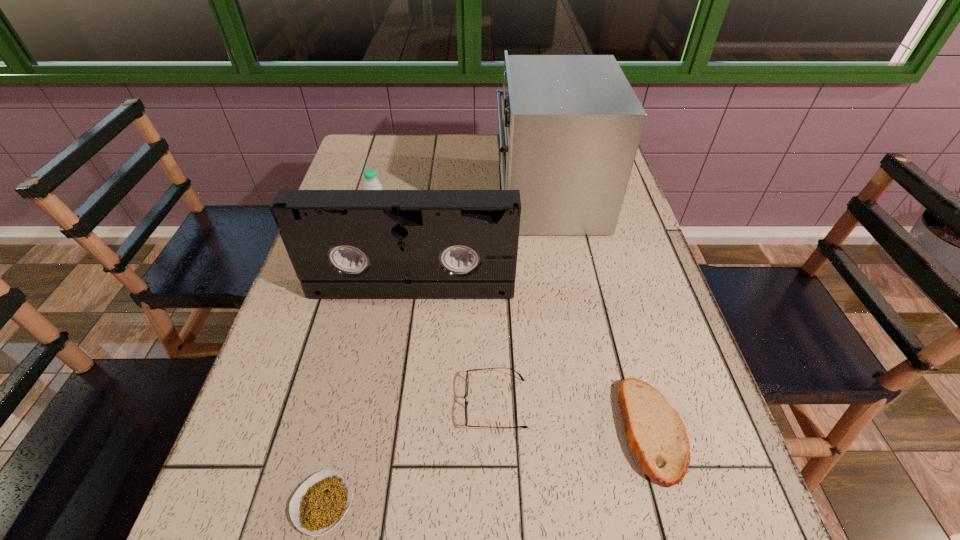
You are a GUI agent. You are given a task and a screenshot of the screen. Output one action in this format:
    pyautogui.click(x=<x>, y=<y>)
    Task: Click on the vacant point located between the pita bread and the videotape
    
    Given the screenshot: What is the action you would take?
    pyautogui.click(x=532, y=359)

Find the location of a particular element. This screenshot has width=960, height=540. free space between the videotape and the second shortest object is located at coordinates (454, 346).

This screenshot has width=960, height=540. I want to click on vacant region between the shortest object and the fourth shortest object, so click(x=351, y=363).

Locate an element on the screen. vacant space that is in between the fifth tallest object and the fourth nearest object is located at coordinates (454, 346).

At what (x,y) coordinates should I click in order to perform the action: click on free point between the pita bread and the videotape. Please return your answer as a coordinate pair (x, y). Image resolution: width=960 pixels, height=540 pixels. Looking at the image, I should click on (532, 359).

In order to click on free spot between the videotape and the spectacles in this screenshot , I will do `click(454, 346)`.

The height and width of the screenshot is (540, 960). Find the location of `free point between the fifth tallest object and the pita bread`. free point between the fifth tallest object and the pita bread is located at coordinates (574, 416).

In order to click on unoccupied area between the tallest object and the legume in this screenshot , I will do `click(436, 351)`.

Find the location of `vacant point located between the spectacles and the toaster oven`. vacant point located between the spectacles and the toaster oven is located at coordinates (522, 301).

Where is `the fifth closest object to the third tallest object`? This screenshot has height=540, width=960. the fifth closest object to the third tallest object is located at coordinates (657, 436).